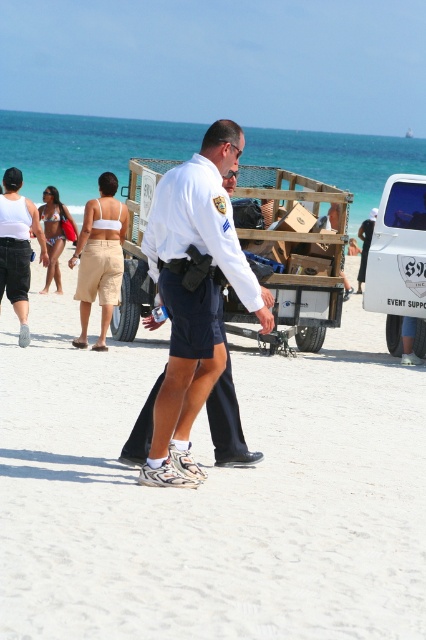
You are a photographer at the beach scene. You need to position a camera at point (210, 492) to capture the white matte uniform at center. What object will be in the camera frame at that point?

The white matte uniform at center is located at point (210, 492), so placing the camera there will capture the white matte uniform at center in the frame.

You are a photographer standing at the beach scene. You want to take a photo that includes both the white uniform at center and the white matte van at right. Which object should you focus on first to ensure both are in frame?

You should focus on the white uniform at center first because it is closer to the viewer than the white matte van at right, so adjusting the camera to include it will also capture the van in the background.